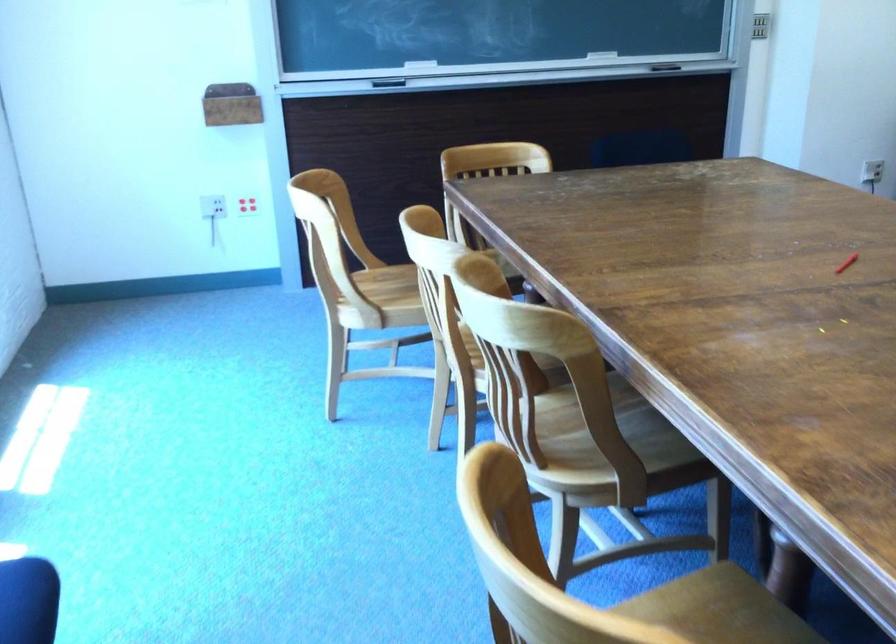
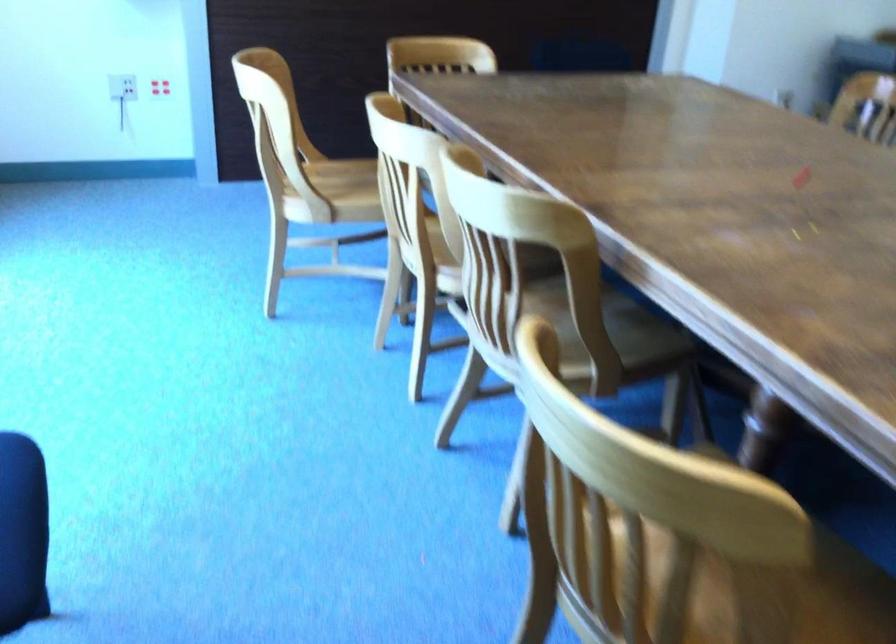
Where in the second image is the point corresponding to [633,451] from the first image?

(615, 345)